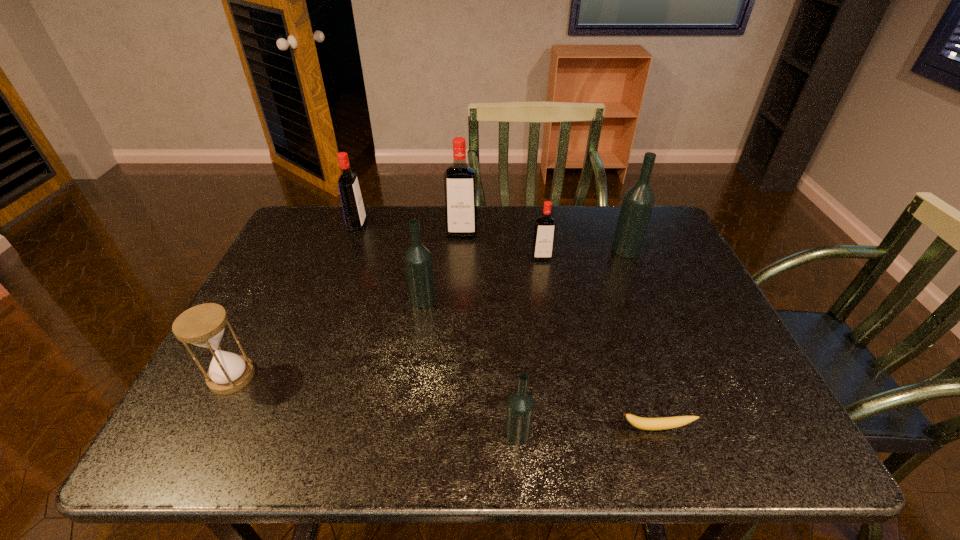
Where is `the biggest black vodka`? Image resolution: width=960 pixels, height=540 pixels. the biggest black vodka is located at coordinates (638, 201).

Find the location of a particular element. the farthest black vodka is located at coordinates (638, 201).

Locate an element on the screen. The width and height of the screenshot is (960, 540). the second red vodka from left to right is located at coordinates point(460,179).

I want to click on the biggest red vodka, so click(x=460, y=179).

At what (x,y) coordinates should I click in order to perform the action: click on the leftmost red vodka. Please return your answer as a coordinate pair (x, y). This screenshot has width=960, height=540. Looking at the image, I should click on (353, 208).

Locate an element on the screen. The width and height of the screenshot is (960, 540). the seventh object from right to left is located at coordinates (353, 208).

Locate an element on the screen. the leftmost black vodka is located at coordinates (418, 261).

Where is `the second biggest black vodka`? Image resolution: width=960 pixels, height=540 pixels. the second biggest black vodka is located at coordinates (418, 261).

Find the location of `the fifth vodka from left to right`. the fifth vodka from left to right is located at coordinates (544, 232).

The height and width of the screenshot is (540, 960). Identify the location of the smallest red vodka. (544, 232).